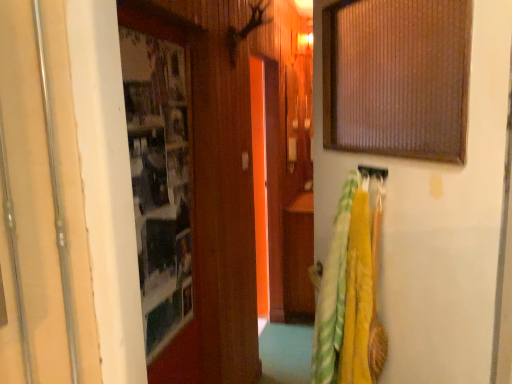
Question: Is yellow fabric towel at right looking in the opposite direction of transparent glass door at center?

Choices:
 (A) yes
 (B) no

Answer: (B)

Question: Is yellow fabric towel at right positioned behind transparent glass door at center?

Choices:
 (A) yes
 (B) no

Answer: (B)

Question: From a real-world perspective, is yellow fabric towel at right on top of transparent glass door at center?

Choices:
 (A) no
 (B) yes

Answer: (B)

Question: Is yellow fabric towel at right positioned in front of transparent glass door at center?

Choices:
 (A) no
 (B) yes

Answer: (B)

Question: Considering the relative positions of yellow fabric towel at right and transparent glass door at center in the image provided, is yellow fabric towel at right to the left of transparent glass door at center from the viewer's perspective?

Choices:
 (A) yes
 (B) no

Answer: (B)

Question: Would you say transparent glass door at center is inside or outside metallic silver door at left?

Choices:
 (A) outside
 (B) inside

Answer: (A)

Question: Is point (253, 160) closer or farther from the camera than point (31, 87)?

Choices:
 (A) farther
 (B) closer

Answer: (A)

Question: From a real-world perspective, is transparent glass door at center positioned above or below metallic silver door at left?

Choices:
 (A) below
 (B) above

Answer: (A)

Question: From the image's perspective, is transparent glass door at center positioned above or below metallic silver door at left?

Choices:
 (A) below
 (B) above

Answer: (A)

Question: From a real-world perspective, relative to yellow fabric towel at right, is metallic silver door at left vertically above or below?

Choices:
 (A) above
 (B) below

Answer: (A)

Question: Choose the correct answer: Is metallic silver door at left inside yellow fabric towel at right or outside it?

Choices:
 (A) outside
 (B) inside

Answer: (A)

Question: From the image's perspective, is metallic silver door at left located above or below yellow fabric towel at right?

Choices:
 (A) below
 (B) above

Answer: (B)

Question: From their relative heights in the image, would you say metallic silver door at left is taller or shorter than yellow fabric towel at right?

Choices:
 (A) tall
 (B) short

Answer: (A)

Question: Would you say transparent glass door at center is inside or outside yellow fabric towel at right?

Choices:
 (A) outside
 (B) inside

Answer: (A)

Question: Is transparent glass door at center in front of or behind yellow fabric towel at right in the image?

Choices:
 (A) front
 (B) behind

Answer: (B)